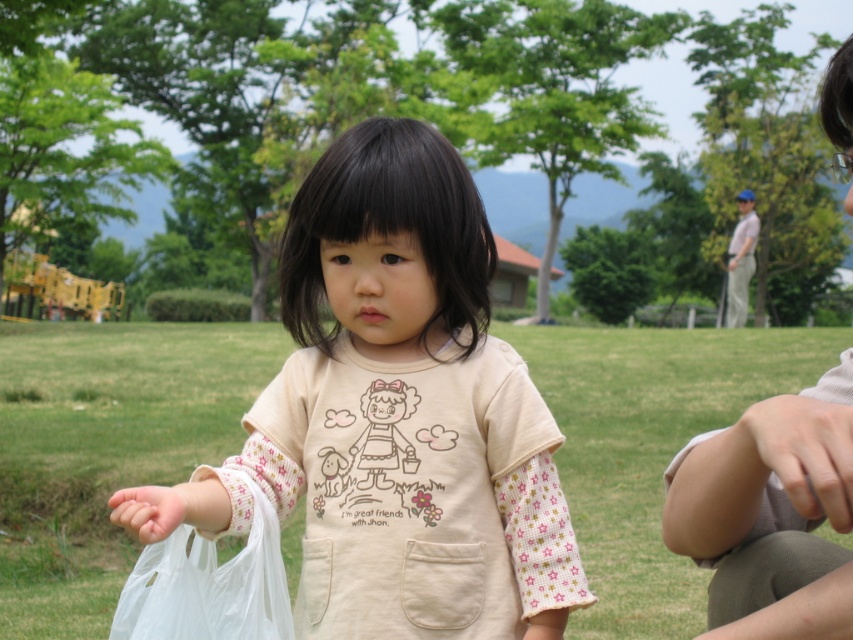
You are a drone operator trying to capture a photo of the child in the park. You have two points marked on your screen for positioning the drone. The first point is at coordinates point (579, 481) and the second is at point (183, 529). Which point should you choose to ensure the drone is positioned behind the child?

Point (579, 481) is behind point (183, 529), so choosing point (579, 481) will position the drone behind the child.

You are standing at the point with coordinates point (x=187, y=486) and want to walk to the point with coordinates point (x=840, y=531). Which direction should you move to reach your destination?

You should move forward because point (x=840, y=531) is in front of point (x=187, y=486).